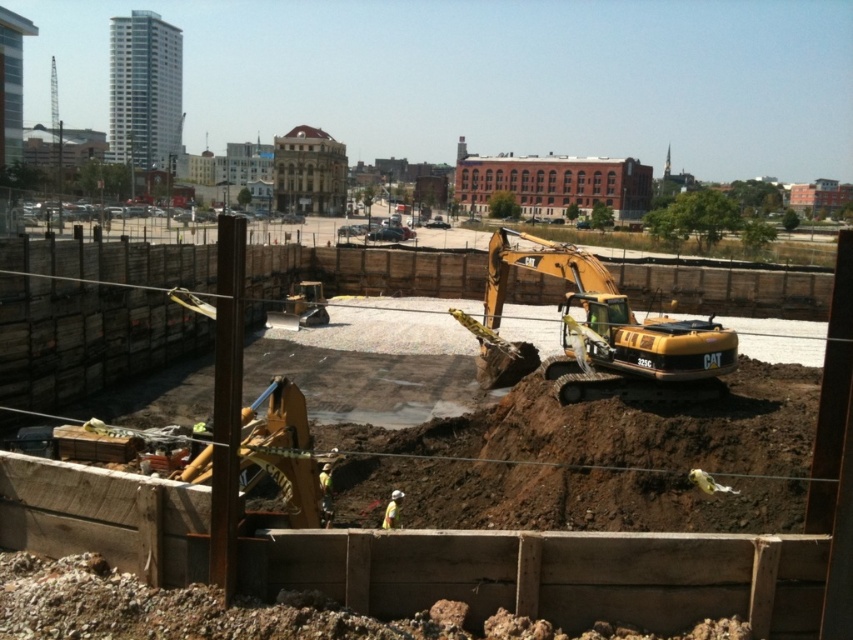
You are a construction worker standing at the origin point of the construction site coordinate system. You need to locate the yellow excavator at center. What are its coordinates?

The yellow excavator at center is located at coordinates point [598,552].

You are a construction worker standing at the edge of the construction site. You need to check the distance between yourself and the yellow excavator at center. According to the site safety guidelines, workers must stay at least 5 meters away from active machinery. Is your current position compliant with the safety regulations?

The yellow excavator at center is 6.61 meters from camera. Since the required distance is at least 5 meters, your current position is compliant with the safety regulations.

You are a drone operator trying to capture aerial footage of the construction site. You need to ensure that your drone can fly between the two points marked as point (137, 490) and point (113, 604) without obstruction. Given that the drone flies at a constant altitude, which point is closer to the drone when it is directly above the midpoint between them?

Point (113, 604) is closer to the drone when it is directly above the midpoint between them because it is nearer to the camera compared to point (137, 490), which is further away.